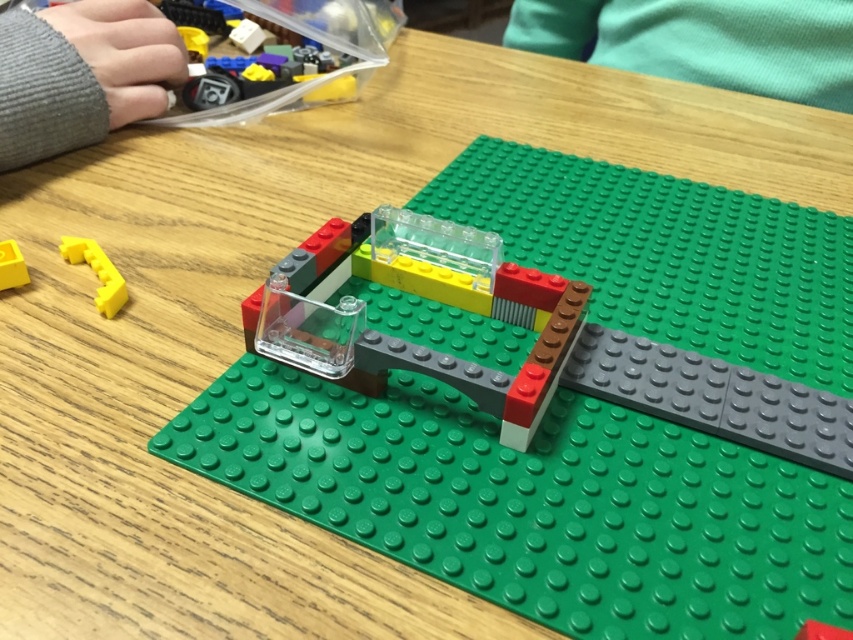
Can you confirm if matte yellow plastic piece at lower left is bigger than yellow matte plastic piece at lower left?

Correct, matte yellow plastic piece at lower left is larger in size than yellow matte plastic piece at lower left.

Between point (115, 300) and point (4, 260), which one is positioned behind?

The point (4, 260) is behind.

What are the coordinates of `matte yellow plastic piece at lower left` in the screenshot? It's located at (96, 273).